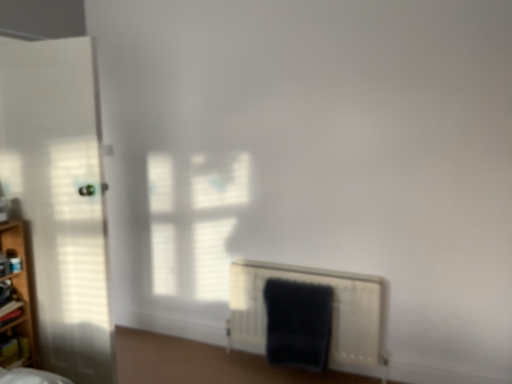
Question: From a real-world perspective, does dark blue plush bath towel at lower right sit lower than wooden shelf at left?

Choices:
 (A) yes
 (B) no

Answer: (A)

Question: Is dark blue plush bath towel at lower right oriented towards wooden shelf at left?

Choices:
 (A) no
 (B) yes

Answer: (A)

Question: From the image's perspective, would you say dark blue plush bath towel at lower right is shown under wooden shelf at left?

Choices:
 (A) no
 (B) yes

Answer: (B)

Question: From a real-world perspective, is dark blue plush bath towel at lower right on top of wooden shelf at left?

Choices:
 (A) yes
 (B) no

Answer: (B)

Question: Is dark blue plush bath towel at lower right positioned behind wooden shelf at left?

Choices:
 (A) no
 (B) yes

Answer: (B)

Question: From a real-world perspective, is wooden shelf at left positioned above or below white matte door at left?

Choices:
 (A) below
 (B) above

Answer: (A)

Question: Looking at their shapes, would you say wooden shelf at left is wider or thinner than white matte door at left?

Choices:
 (A) thin
 (B) wide

Answer: (A)

Question: From the image's perspective, is wooden shelf at left located above or below white matte door at left?

Choices:
 (A) above
 (B) below

Answer: (B)

Question: In terms of height, does wooden shelf at left look taller or shorter compared to white matte door at left?

Choices:
 (A) short
 (B) tall

Answer: (A)

Question: From the image's perspective, relative to wooden shelf at left, is white matte door at left above or below?

Choices:
 (A) below
 (B) above

Answer: (B)

Question: Choose the correct answer: Is white matte door at left inside wooden shelf at left or outside it?

Choices:
 (A) outside
 (B) inside

Answer: (A)

Question: Relative to wooden shelf at left, is white matte door at left in front or behind?

Choices:
 (A) behind
 (B) front

Answer: (B)

Question: Is point (81, 178) positioned closer to the camera than point (14, 327)?

Choices:
 (A) closer
 (B) farther

Answer: (A)

Question: From a real-world perspective, is wooden shelf at left above or below dark blue plush bath towel at lower right?

Choices:
 (A) above
 (B) below

Answer: (A)

Question: Considering the relative positions of wooden shelf at left and dark blue plush bath towel at lower right in the image provided, is wooden shelf at left to the left or to the right of dark blue plush bath towel at lower right?

Choices:
 (A) left
 (B) right

Answer: (A)